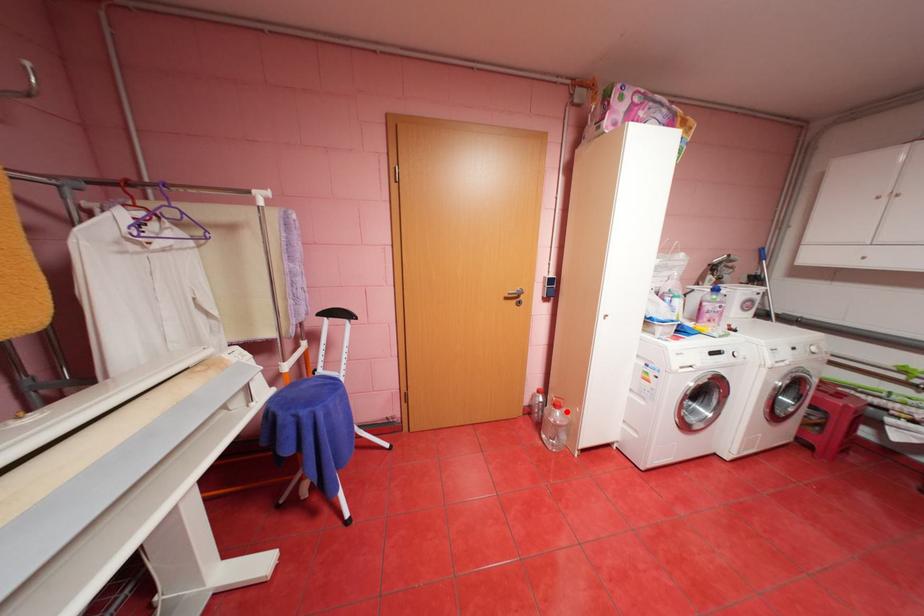
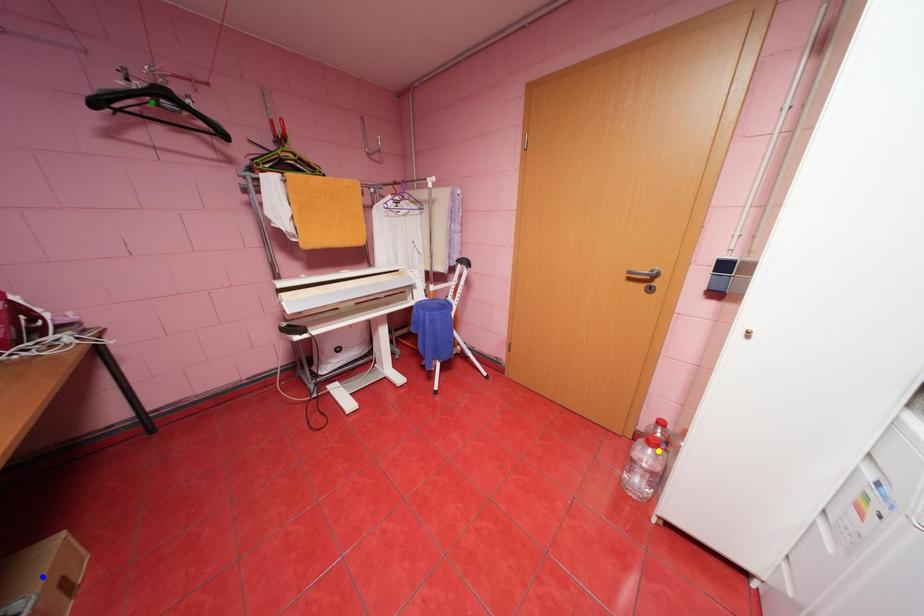
Question: I am providing you with two images of the same scene from different viewpoints. A red point is marked on the first image. You are given multiple points on the second image. Which point in image 2 represents the same 3d spot as the red point in image 1?

Choices:
 (A) green point
 (B) yellow point
 (C) blue point

Answer: (B)